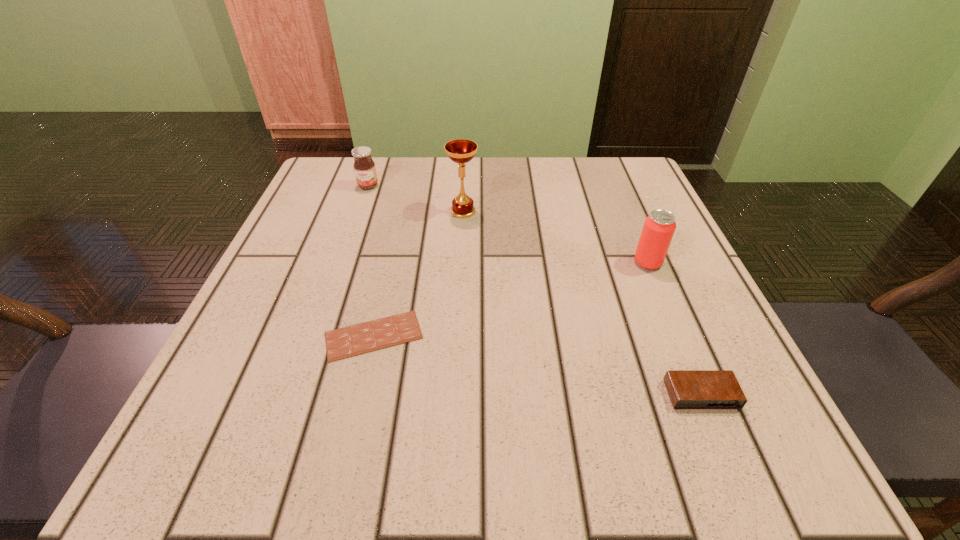
This screenshot has width=960, height=540. I want to click on free point that satisfies the following two spatial constraints: 1. on the label side of the jam; 2. on the left side of the chalice, so click(359, 211).

This screenshot has height=540, width=960. I want to click on vacant region that satisfies the following two spatial constraints: 1. on the label side of the chocolate bar; 2. on the right side of the jam, so click(316, 336).

Identify the location of vacant space that satisfies the following two spatial constraints: 1. on the label side of the jam; 2. on the right side of the second tallest object. Image resolution: width=960 pixels, height=540 pixels. (342, 263).

The image size is (960, 540). What are the coordinates of `free space that satisfies the following two spatial constraints: 1. on the back side of the chocolate bar; 2. on the left side of the third nearest object` in the screenshot? It's located at (390, 263).